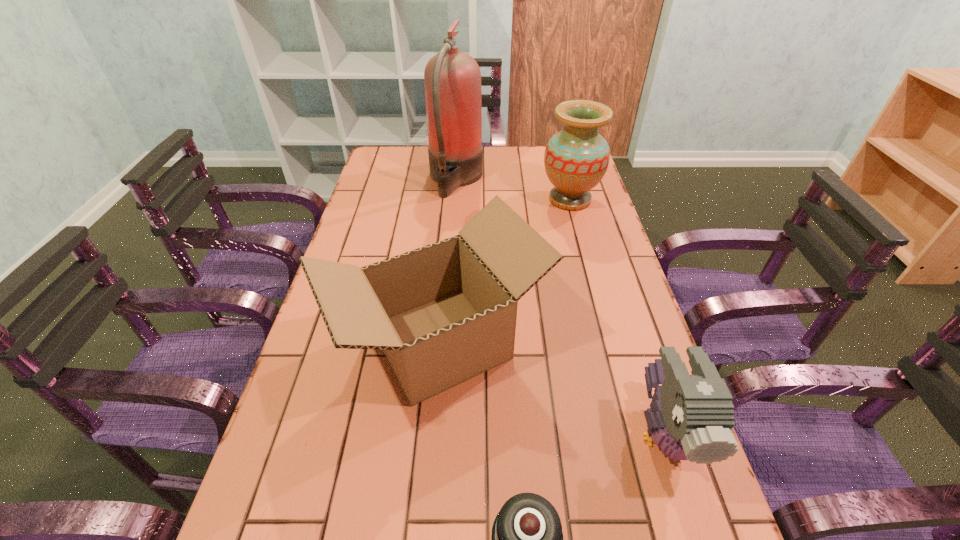
This screenshot has height=540, width=960. What are the coordinates of `the tallest object` in the screenshot? It's located at (452, 79).

Where is `vase`? This screenshot has width=960, height=540. vase is located at coordinates (576, 158).

Locate an element on the screen. This screenshot has height=540, width=960. box is located at coordinates (446, 312).

Find the location of `bird`. bird is located at coordinates (690, 417).

The image size is (960, 540). Identify the location of free space located 0.200m at the nozzle of the tallest object. (539, 179).

The image size is (960, 540). I want to click on vacant region located 0.080m on the front of the vase, so click(x=579, y=232).

At what (x,y) coordinates should I click in order to perform the action: click on free space located 0.060m on the back of the box. Please return your answer as a coordinate pair (x, y). The image size is (960, 540). Looking at the image, I should click on (446, 263).

Find the location of `object at the far edge`. object at the far edge is located at coordinates (452, 79).

Locate an element on the screen. object that is positioned at the left edge is located at coordinates (446, 312).

Locate an element on the screen. vase located in the right edge section of the desktop is located at coordinates pos(576,158).